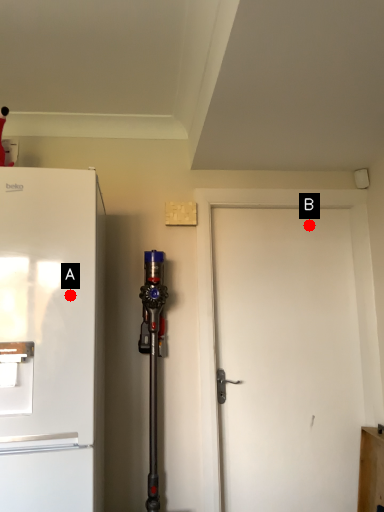
Question: Two points are circled on the image, labeled by A and B beside each circle. Which point is farther to the camera?

Choices:
 (A) A is further
 (B) B is further

Answer: (B)